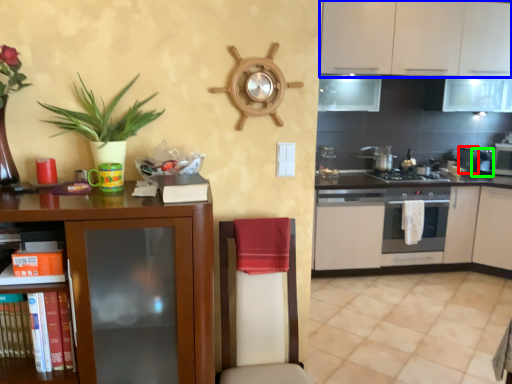
Question: Which object is positioned closest to appliance (highlighted by a red box)? Select from cabinetry (highlighted by a blue box) and appliance (highlighted by a green box).

Choices:
 (A) cabinetry
 (B) appliance

Answer: (B)